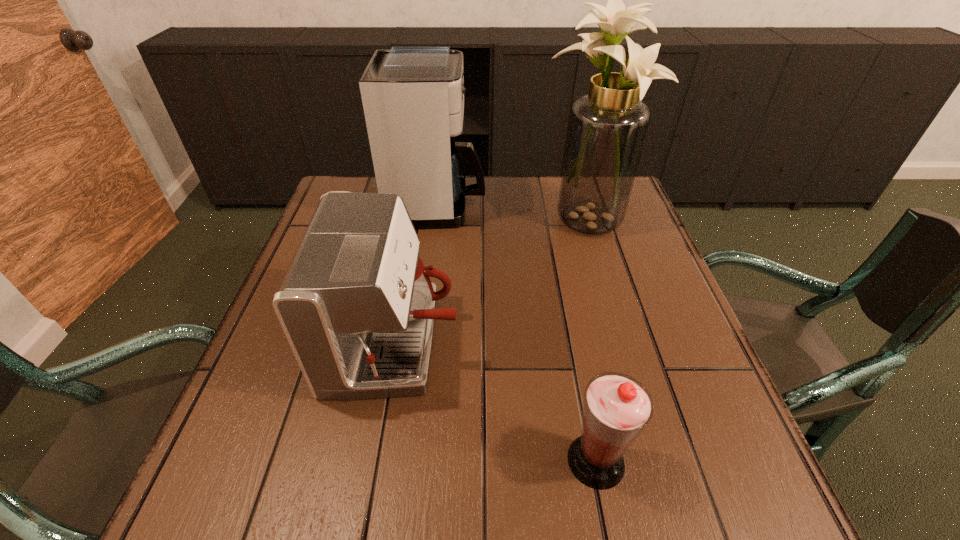
Locate an element on the screen. The image size is (960, 540). the tallest object is located at coordinates (607, 128).

Locate an element on the screen. the second tallest object is located at coordinates (413, 96).

Where is `the taller coffee maker`? This screenshot has height=540, width=960. the taller coffee maker is located at coordinates point(413,96).

Where is `the nearer coffee maker`? The width and height of the screenshot is (960, 540). the nearer coffee maker is located at coordinates (357, 306).

Find the location of a particular element. The height and width of the screenshot is (540, 960). the shorter coffee maker is located at coordinates [x=357, y=306].

Locate an element on the screen. The width and height of the screenshot is (960, 540). smoothie is located at coordinates (617, 407).

You are a GUI agent. You are given a task and a screenshot of the screen. Output one action in this format:
    pyautogui.click(x=<x>, y=<y>)
    Task: Click on the nearest object
    This screenshot has width=960, height=540.
    Given the screenshot: What is the action you would take?
    point(617,407)

Where is `free space located on the left of the flower arrangement`? The height and width of the screenshot is (540, 960). free space located on the left of the flower arrangement is located at coordinates (471, 221).

Find the location of a particular element. vacant space positioned 0.080m on the front panel of the second tallest object is located at coordinates (513, 206).

This screenshot has width=960, height=540. What are the coordinates of `free space located 0.060m on the front of the third farthest object near the spout` in the screenshot? It's located at (489, 343).